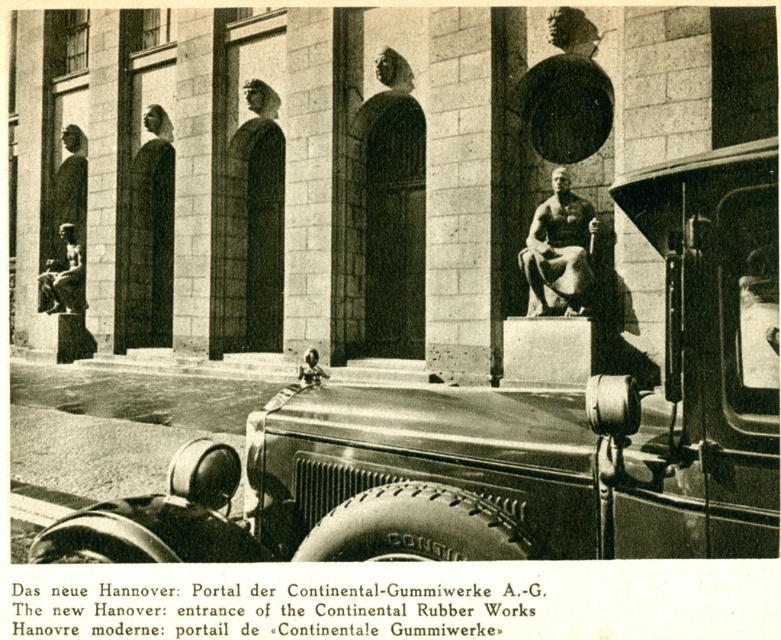
From the picture: You are a photographer standing at the entrance of the Continental Rubber Works. You want to take a photo of both the shiny chrome car at center and the matte bronze statue at center. Considering the distance between them, will you need to use a wide angle lens to capture both subjects in a single frame?

The distance between the shiny chrome car at center and the matte bronze statue at center is 14.97 meters. To capture both subjects in a single frame from the entrance, you would need a wide angle lens since the subjects are far apart.